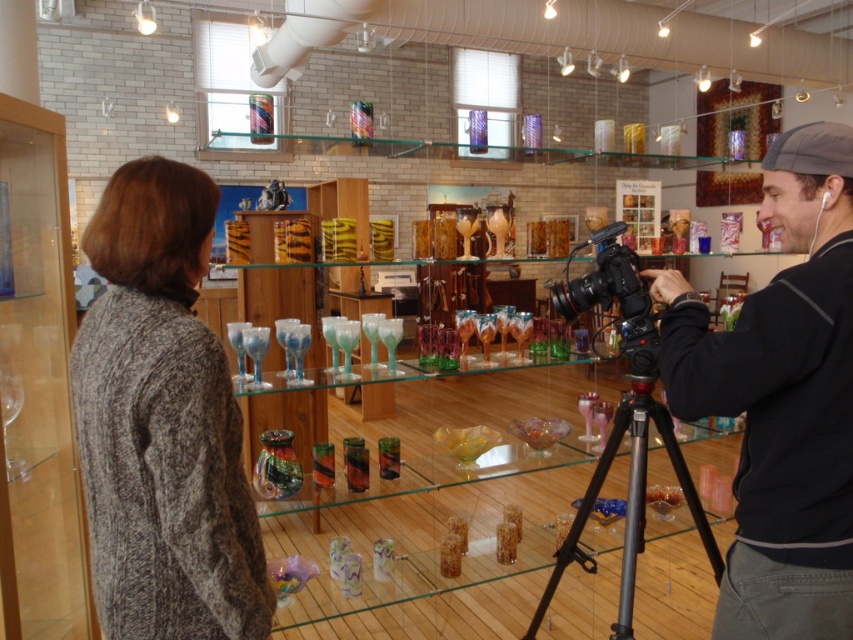
Question: Can you confirm if black matte camera at center is positioned to the left of black plastic video camera at center?

Choices:
 (A) no
 (B) yes

Answer: (B)

Question: Which is farther from the black matte camera at center?

Choices:
 (A) black plastic video camera at center
 (B) black metal tripod at center

Answer: (B)

Question: Which point is farther to the camera?

Choices:
 (A) black plastic video camera at center
 (B) black matte camera at center
 (C) black metal tripod at center

Answer: (A)

Question: Can you confirm if black matte camera at center is wider than black plastic video camera at center?

Choices:
 (A) yes
 (B) no

Answer: (B)

Question: Can you confirm if black matte camera at center is positioned to the right of black metal tripod at center?

Choices:
 (A) no
 (B) yes

Answer: (A)

Question: Which point is farther to the camera?

Choices:
 (A) black plastic video camera at center
 (B) black metal tripod at center

Answer: (A)